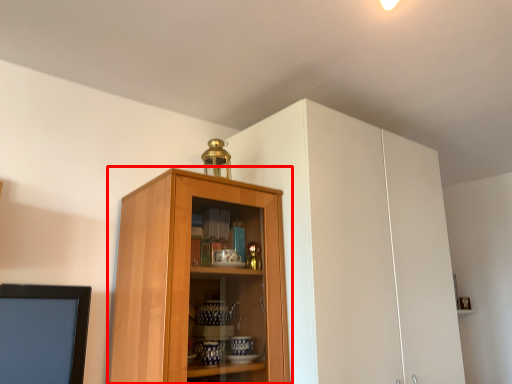
Question: Observing the image, what is the correct spatial positioning of cupboard (annotated by the red box) in reference to cabinetry?

Choices:
 (A) right
 (B) left

Answer: (B)